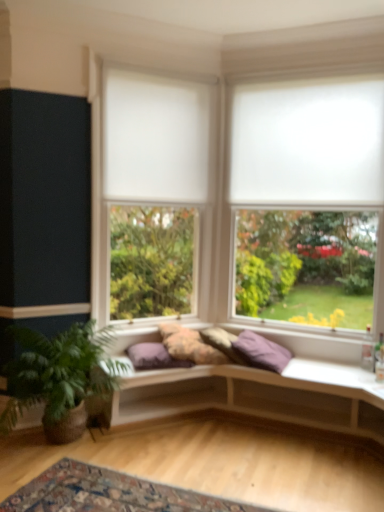
You are a GUI agent. You are given a task and a screenshot of the screen. Output one action in this format:
    pyautogui.click(x=<x>, y=<y>)
    Task: Click on the blank space situated above white matte window at upper right, marked as the second window in a left-to-right arrangement (from a real-world perspective)
    
    Given the screenshot: What is the action you would take?
    pyautogui.click(x=306, y=56)